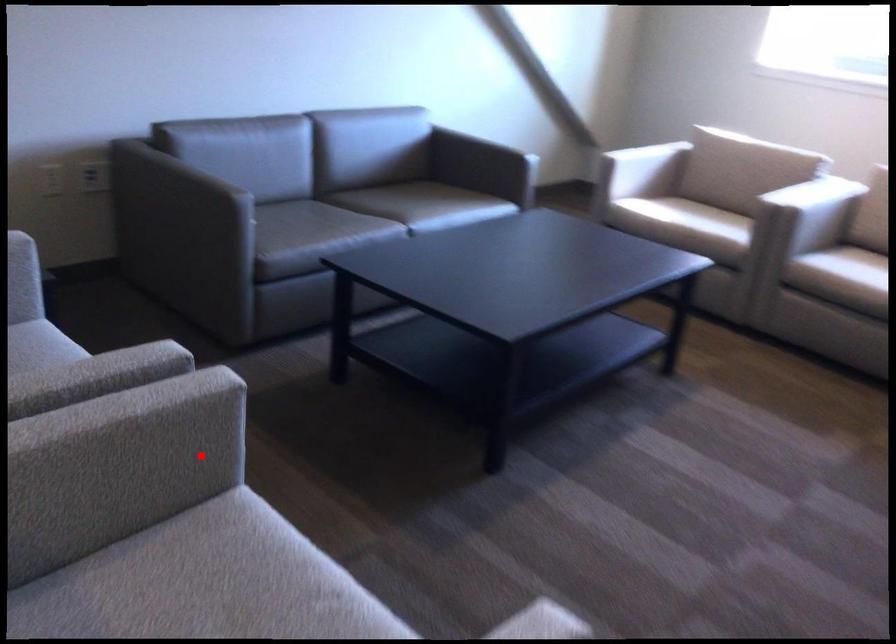
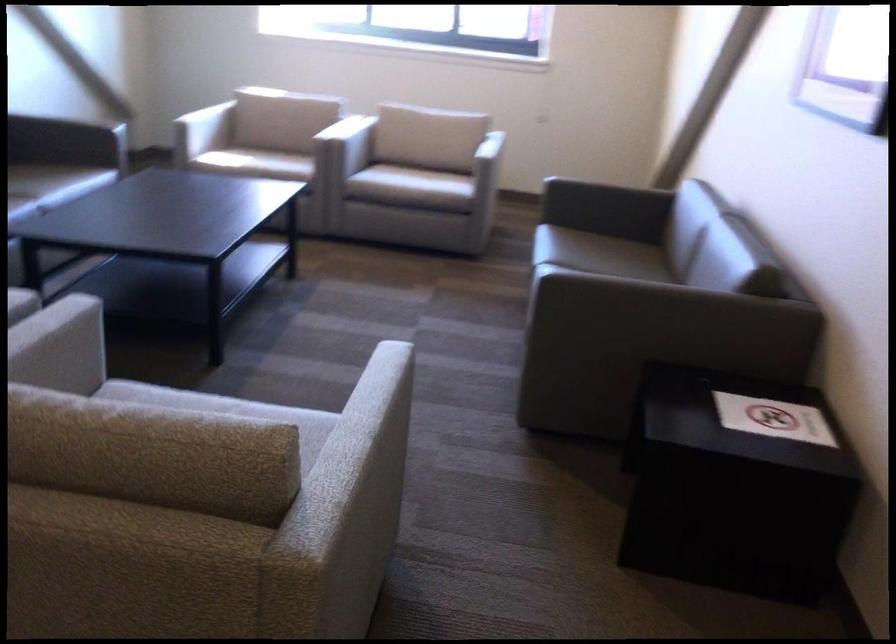
Question: I am providing you with two images of the same scene from different viewpoints. In image1, a red point is highlighted. Considering the same 3D point in image2, which of the following is correct?

Choices:
 (A) It is closer
 (B) It is farther

Answer: (B)